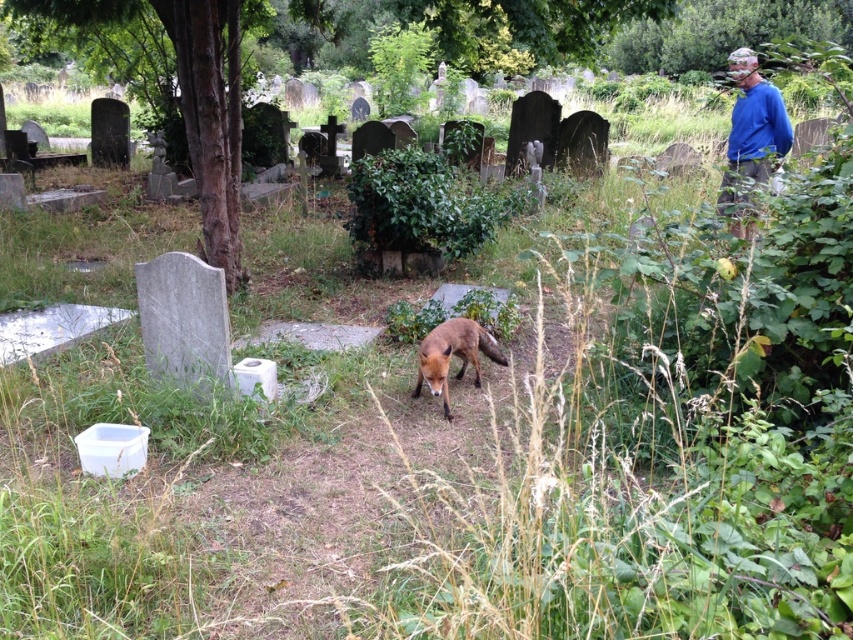
Question: Which object is farther from the camera taking this photo?

Choices:
 (A) reddish-brown fur fox at center
 (B) blue cotton shirt at upper right

Answer: (B)

Question: Is blue cotton shirt at upper right wider than reddish-brown fur fox at center?

Choices:
 (A) no
 (B) yes

Answer: (A)

Question: Among these objects, which one is farthest from the camera?

Choices:
 (A) blue cotton shirt at upper right
 (B) reddish-brown fur fox at center

Answer: (A)

Question: Where is blue cotton shirt at upper right located in relation to reddish-brown fur fox at center in the image?

Choices:
 (A) left
 (B) right

Answer: (B)

Question: Can you confirm if blue cotton shirt at upper right is smaller than reddish-brown fur fox at center?

Choices:
 (A) yes
 (B) no

Answer: (A)

Question: Which of the following is the closest to the observer?

Choices:
 (A) (757, 157)
 (B) (500, 358)

Answer: (B)